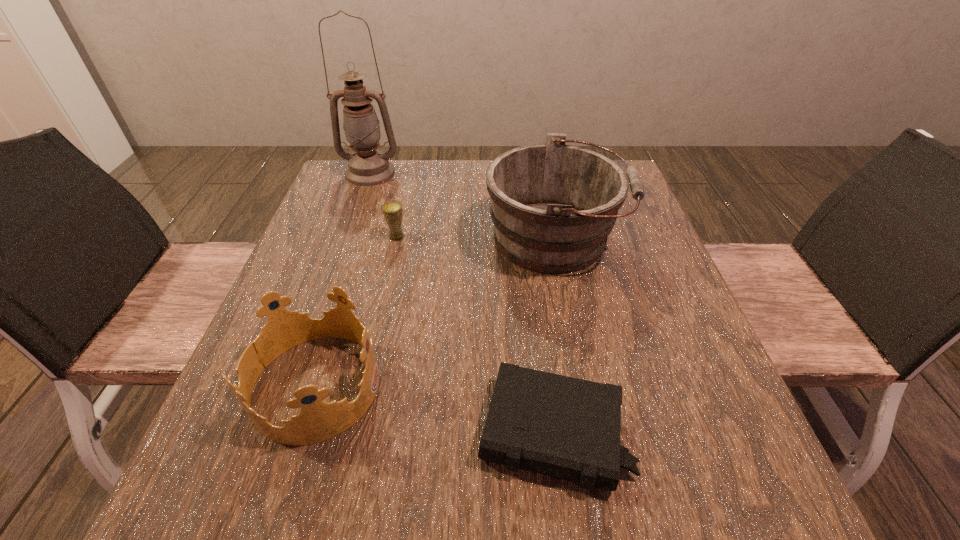
Find the location of a particular element. vacant region at the left edge of the desktop is located at coordinates (304, 450).

Identify the location of vacant space at the right edge. The width and height of the screenshot is (960, 540). (623, 252).

In the image, there is a desktop. At what (x,y) coordinates should I click in order to perform the action: click on vacant space at the near right corner. Please return your answer as a coordinate pair (x, y). Looking at the image, I should click on pyautogui.click(x=780, y=515).

Identify the location of free spot between the fourth shortest object and the straw for drinking. This screenshot has height=540, width=960. (476, 238).

You are a GUI agent. You are given a task and a screenshot of the screen. Output one action in this format:
    pyautogui.click(x=<x>, y=<y>)
    Task: Click on the vacant point located between the fourth shortest object and the tiara
    The height and width of the screenshot is (540, 960).
    Given the screenshot: What is the action you would take?
    pyautogui.click(x=435, y=312)

The height and width of the screenshot is (540, 960). Find the location of `free space that is in between the tiara and the oil lamp`. free space that is in between the tiara and the oil lamp is located at coordinates (343, 279).

Locate an element on the screen. This screenshot has height=540, width=960. free spot between the shortest object and the tiara is located at coordinates (435, 409).

Where is `vacant area that lies between the tiara and the straw for drinking`? vacant area that lies between the tiara and the straw for drinking is located at coordinates (356, 311).

Identify the location of free point between the wine bucket and the straw for drinking. The height and width of the screenshot is (540, 960). (476, 238).

Find the location of a particular element. vacant region between the straw for drinking and the wine bucket is located at coordinates (476, 238).